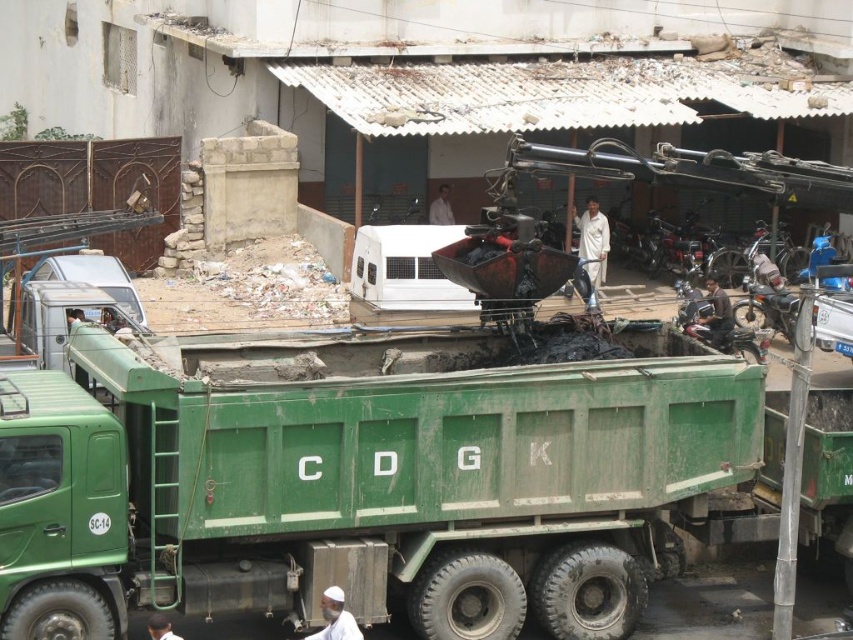
Question: Does white matte shirt at center have a lesser width compared to dark skin human at lower center?

Choices:
 (A) yes
 (B) no

Answer: (B)

Question: Which of the following is the farthest from the observer?

Choices:
 (A) (589, 276)
 (B) (724, 298)

Answer: (A)

Question: Which of the following is the closest to the observer?

Choices:
 (A) (773, 285)
 (B) (329, 624)
 (C) (601, 221)

Answer: (B)

Question: Estimate the real-world distances between objects in this image. Which object is closer to the dark brown leather jacket at upper right?

Choices:
 (A) white matte shirt at center
 (B) dark skin human at lower center
 (C) white cloth at lower center

Answer: (A)

Question: From the image, what is the correct spatial relationship of green matte truck at center in relation to white matte shirt at center?

Choices:
 (A) right
 (B) left

Answer: (B)

Question: Can you confirm if green matte truck at center is positioned to the right of dark brown leather jacket at upper right?

Choices:
 (A) no
 (B) yes

Answer: (A)